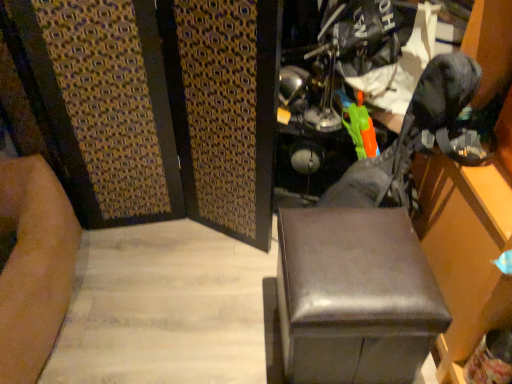
Question: Is leather swivel chair at center taller or shorter than shiny brown ottoman at center?

Choices:
 (A) short
 (B) tall

Answer: (B)

Question: Would you say leather swivel chair at center is inside or outside shiny brown ottoman at center?

Choices:
 (A) outside
 (B) inside

Answer: (A)

Question: Visually, is leather swivel chair at center positioned to the left or to the right of shiny brown ottoman at center?

Choices:
 (A) left
 (B) right

Answer: (B)

Question: From a real-world perspective, is shiny brown ottoman at center above or below leather swivel chair at center?

Choices:
 (A) below
 (B) above

Answer: (A)

Question: In the image, is shiny brown ottoman at center on the left side or the right side of leather swivel chair at center?

Choices:
 (A) right
 (B) left

Answer: (B)

Question: In terms of size, does shiny brown ottoman at center appear bigger or smaller than leather swivel chair at center?

Choices:
 (A) small
 (B) big

Answer: (A)

Question: Relative to leather swivel chair at center, is shiny brown ottoman at center in front or behind?

Choices:
 (A) front
 (B) behind

Answer: (B)